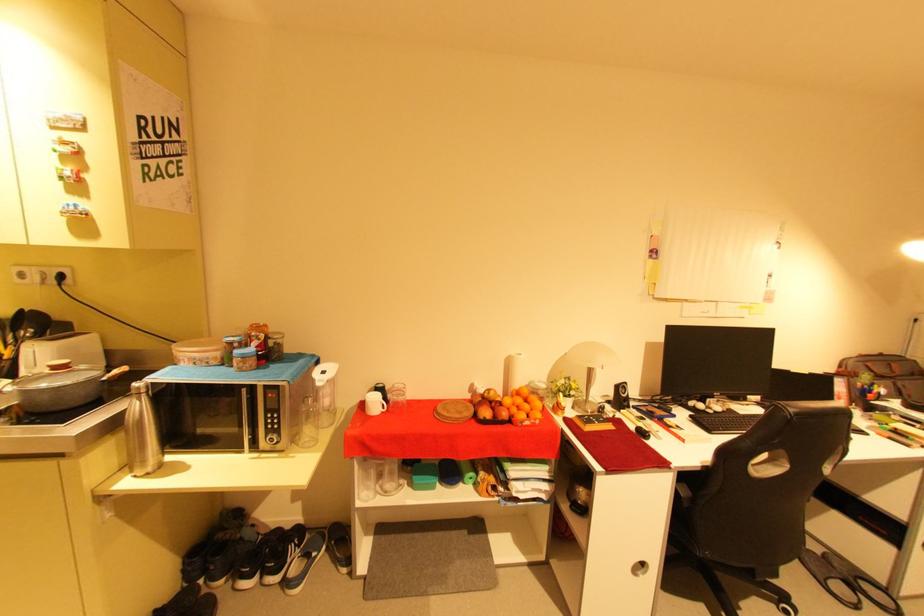
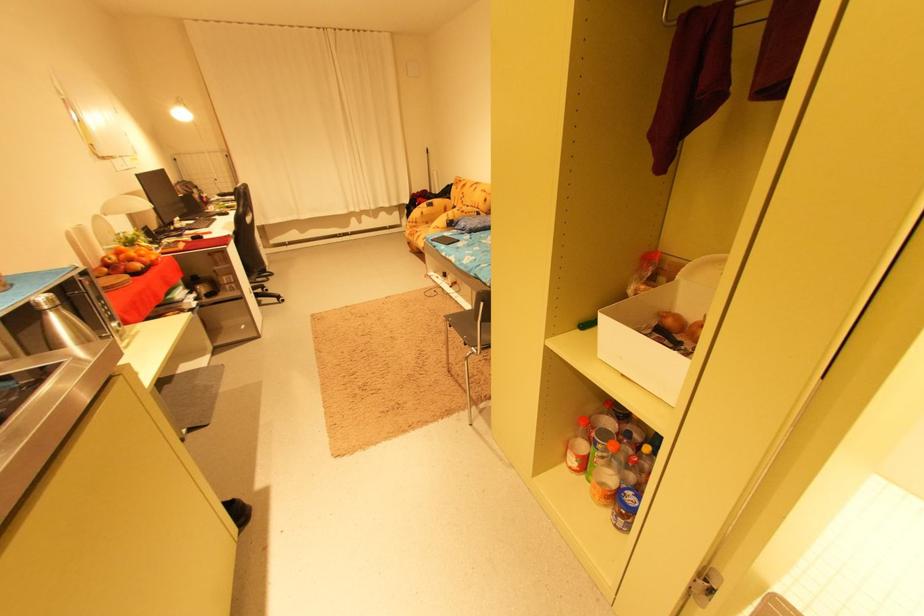
Find the pixel in the second image that matches [503,416] in the first image.

(151, 265)